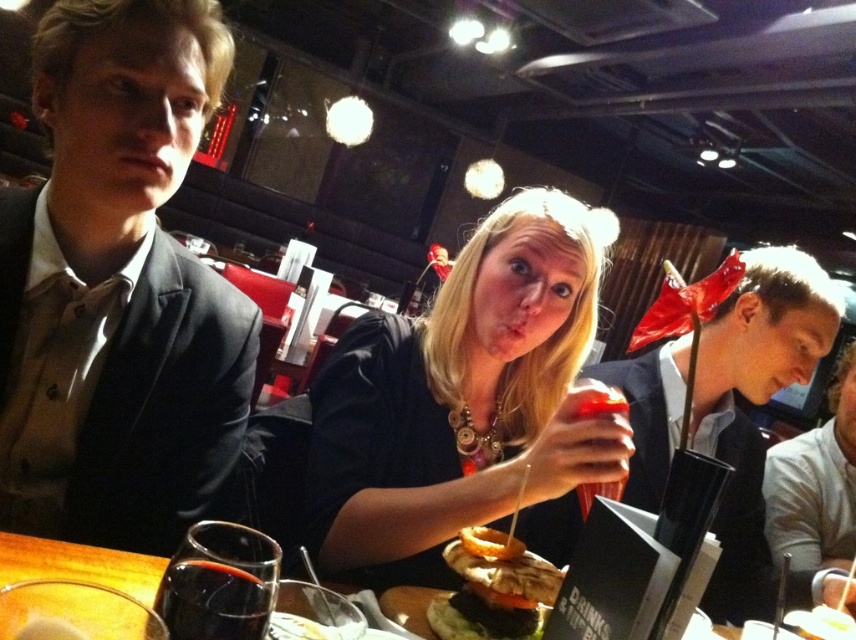
You are a waiter at the restaurant and need to deliver a drink to the customer. The drink should be placed between the matte black shirt at center and the slightly toasted bun at center. Which object should the drink be closer to?

The drink should be placed closer to the slightly toasted bun at center because the matte black shirt at center is to the right of the slightly toasted bun at center.

You are a server at the restaurant and need to place a new drink order on the table. The drink order is a tall glass of water. The table already has the matte black shirt at center and the slightly toasted bun at center. Which object should you move to make space for the drink order?

The slightly toasted bun at center should be moved because the matte black shirt at center is wider and would be harder to shift, while the slightly toasted bun at center is narrower and easier to move aside to make space for the drink order.